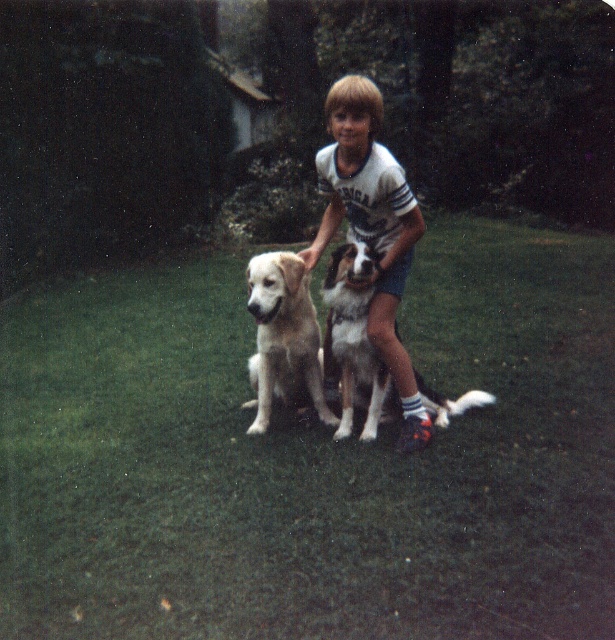
Question: Is green grass at center thinner than white cotton shirt at center?

Choices:
 (A) no
 (B) yes

Answer: (B)

Question: Which of these objects is positioned farthest from the green grass at center?

Choices:
 (A) white fur dog at center
 (B) light brown fur at center
 (C) white cotton shirt at center

Answer: (C)

Question: Which object is positioned farthest from the light brown fur at center?

Choices:
 (A) white cotton shirt at center
 (B) white fur dog at center

Answer: (A)

Question: Among these objects, which one is farthest from the camera?

Choices:
 (A) white fur dog at center
 (B) green grass at center
 (C) white cotton shirt at center

Answer: (B)

Question: Can you confirm if green grass at center is positioned to the right of light brown fur at center?

Choices:
 (A) yes
 (B) no

Answer: (B)

Question: Can you confirm if green grass at center is positioned above white cotton shirt at center?

Choices:
 (A) no
 (B) yes

Answer: (A)